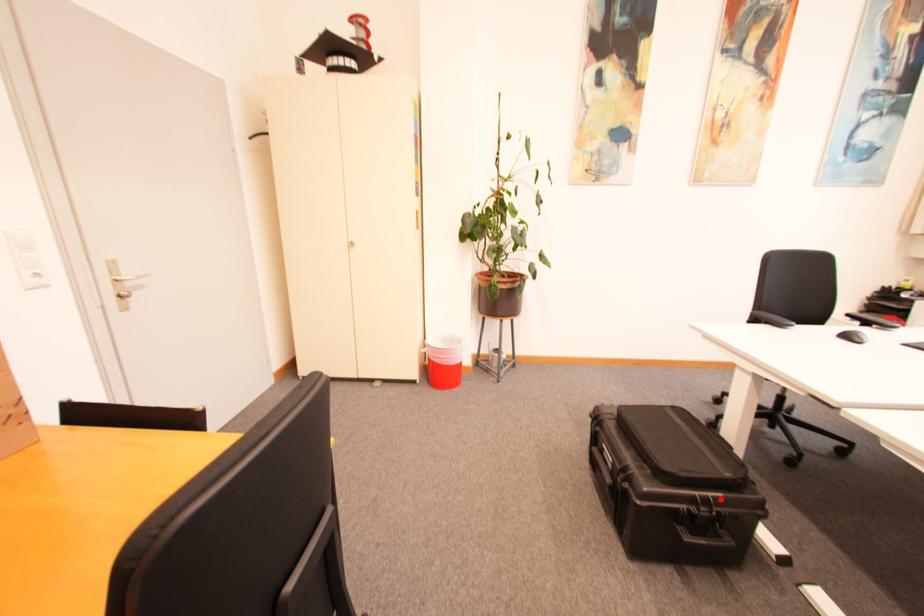
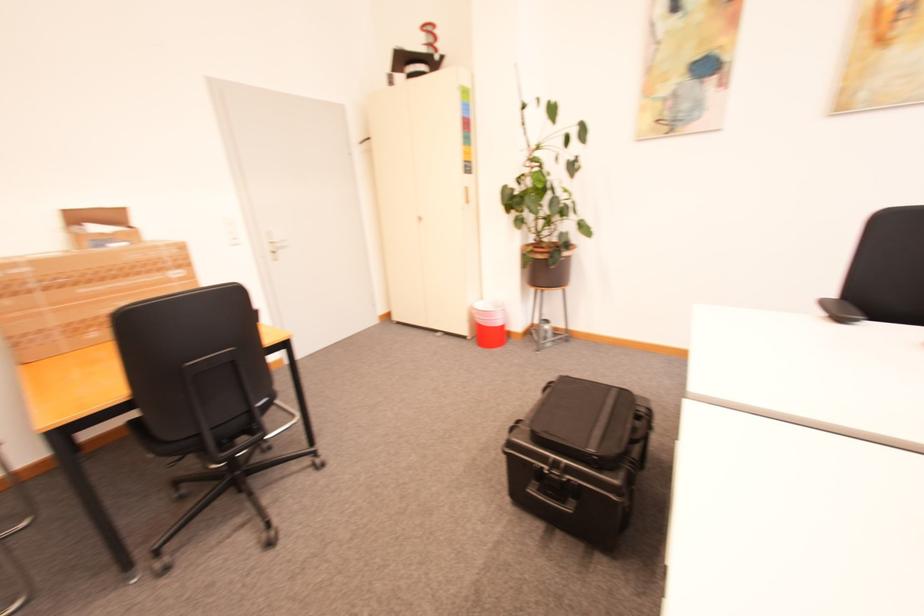
Question: A red point is marked in image1. In image2, is the corresponding 3D point closer to the camera or farther? Reply with the corresponding letter.

Choices:
 (A) The corresponding 3D point is closer.
 (B) The corresponding 3D point is farther.

Answer: (B)